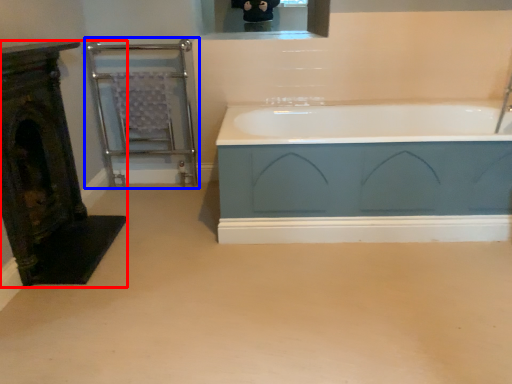
Question: Among these objects, which one is nearest to the camera, fireplace (highlighted by a red box) or balustrade (highlighted by a blue box)?

Choices:
 (A) fireplace
 (B) balustrade

Answer: (A)